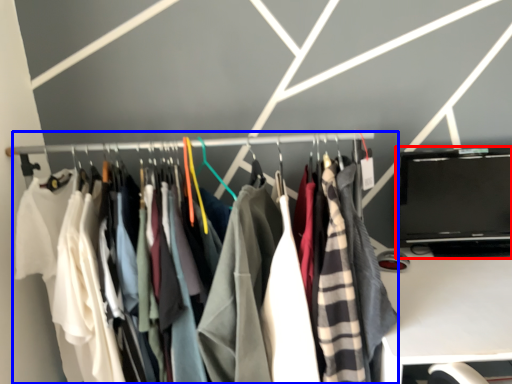
Question: Which of the following is the closest to the observer, laptop (highlighted by a red box) or closet (highlighted by a blue box)?

Choices:
 (A) laptop
 (B) closet

Answer: (B)